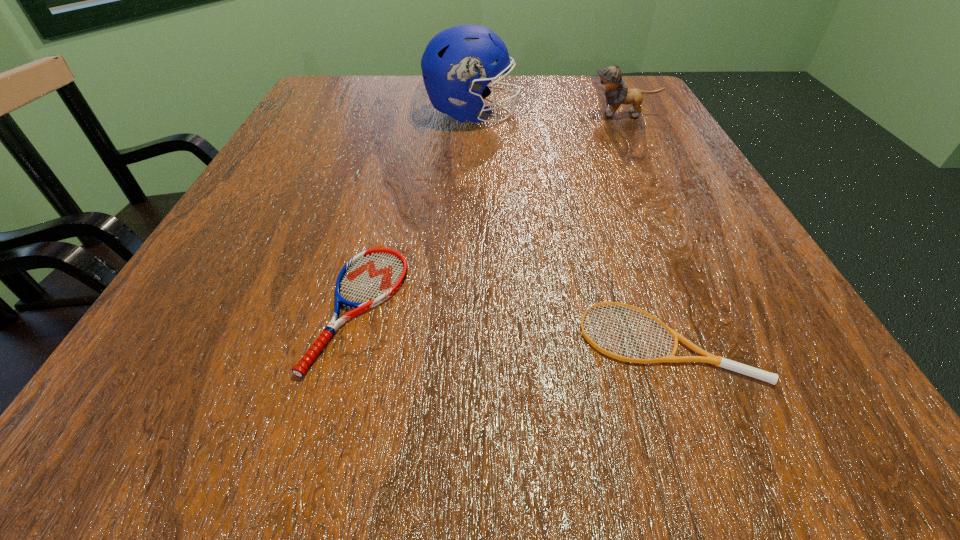
Where is `free spot between the right tennis racket and the tallest object`? free spot between the right tennis racket and the tallest object is located at coordinates (568, 227).

The height and width of the screenshot is (540, 960). What are the coordinates of `free space between the right tennis racket and the left tennis racket` in the screenshot? It's located at pos(512,323).

Where is `the closest object relative to the right tennis racket`? This screenshot has height=540, width=960. the closest object relative to the right tennis racket is located at coordinates (371, 277).

The image size is (960, 540). Find the location of `object that is the third closest to the tallest object`. object that is the third closest to the tallest object is located at coordinates (705, 357).

You are a GUI agent. You are given a task and a screenshot of the screen. Output one action in this format:
    pyautogui.click(x=<x>, y=<y>)
    Task: Click on the free region that satisfies the following two spatial constraints: 1. on the front-facing side of the second tallest object; 2. on the front side of the right tennis racket
    The image size is (960, 540).
    Given the screenshot: What is the action you would take?
    pyautogui.click(x=738, y=339)

Where is `free point that satisfies the following two spatial constraints: 1. on the back side of the right tennis racket; 2. on the front-facing side of the tallest object`? free point that satisfies the following two spatial constraints: 1. on the back side of the right tennis racket; 2. on the front-facing side of the tallest object is located at coordinates (582, 114).

The width and height of the screenshot is (960, 540). Identify the location of free space that satisfies the following two spatial constraints: 1. on the front-facing side of the third shortest object; 2. on the front side of the right tennis racket. (738, 339).